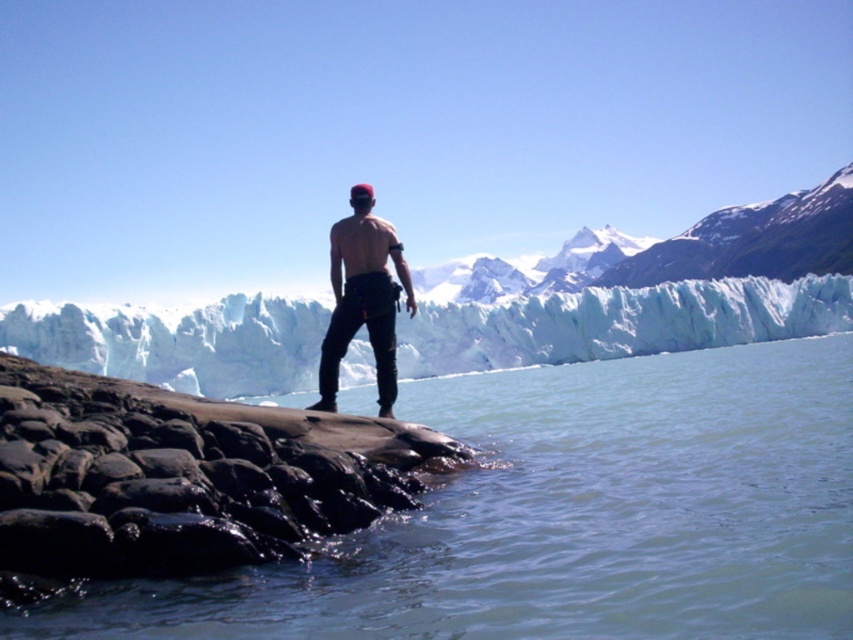
You are planning to climb from the smooth dark rock at lower left to the white ice glacier at center. Based on their heights, which one is easier to climb onto from the ground?

The smooth dark rock at lower left is easier to climb onto from the ground because it has a lesser height compared to the white ice glacier at center.

You are a photographer planning to take a picture of the clear water at lower center and the white ice glacier at center. Based on their positions, which object should you focus on first if you want to capture both in a single frame without moving the camera?

The clear water at lower center should be focused on first since it is positioned on the left side of the white ice glacier at center, allowing both to be captured in the frame by centering the glacier and including the water to its left.

You are standing on the rocky shoreline and want to move towards the glacier. The smooth dark rock at lower left and the matte black pants at center are in your path. Which object should you avoid stepping on to stay closer to the glacier?

You should avoid stepping on the smooth dark rock at lower left because it is to the left of the matte black pants at center. To stay closer to the glacier, move towards the right side of the matte black pants at center.